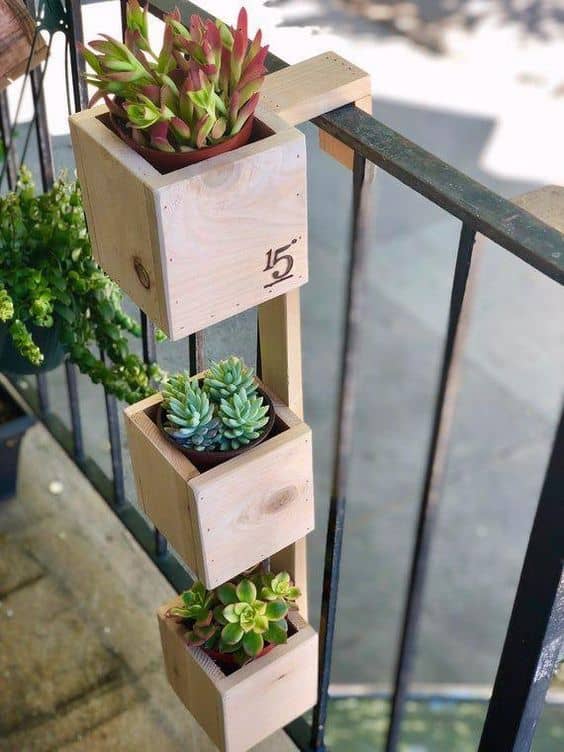
Locate an element on the screen. plant is located at coordinates (190, 77).